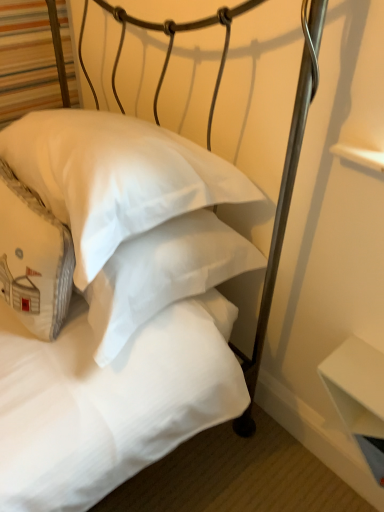
Identify the location of free point above white matte table at lower right (from a real-world perspective). This screenshot has width=384, height=512. (366, 368).